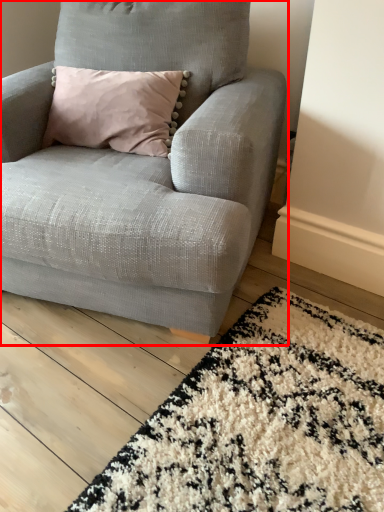
Question: From the image's perspective, where is chair (annotated by the red box) located relative to mat?

Choices:
 (A) below
 (B) above

Answer: (B)